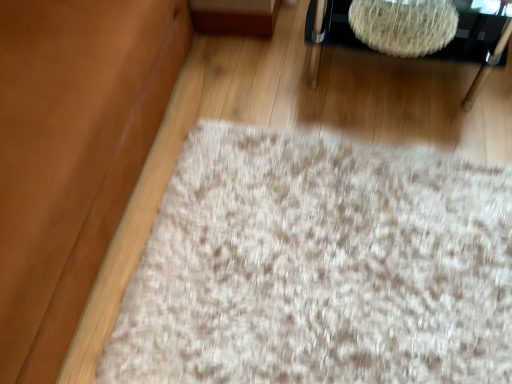
Question: Looking at the image, does suede-like brown couch at lower left seem bigger or smaller compared to white textured rug at upper right?

Choices:
 (A) small
 (B) big

Answer: (B)

Question: Choose the correct answer: Is suede-like brown couch at lower left inside white textured rug at upper right or outside it?

Choices:
 (A) outside
 (B) inside

Answer: (A)

Question: In the image, is suede-like brown couch at lower left positioned in front of or behind white textured rug at upper right?

Choices:
 (A) behind
 (B) front

Answer: (B)

Question: From the image's perspective, is white textured rug at upper right positioned above or below suede-like brown couch at lower left?

Choices:
 (A) above
 (B) below

Answer: (A)

Question: Considering the relative positions of white textured rug at upper right and suede-like brown couch at lower left in the image provided, is white textured rug at upper right to the left or to the right of suede-like brown couch at lower left?

Choices:
 (A) right
 (B) left

Answer: (A)

Question: Relative to suede-like brown couch at lower left, is white textured rug at upper right in front or behind?

Choices:
 (A) behind
 (B) front

Answer: (A)

Question: Would you say white textured rug at upper right is inside or outside suede-like brown couch at lower left?

Choices:
 (A) inside
 (B) outside

Answer: (B)